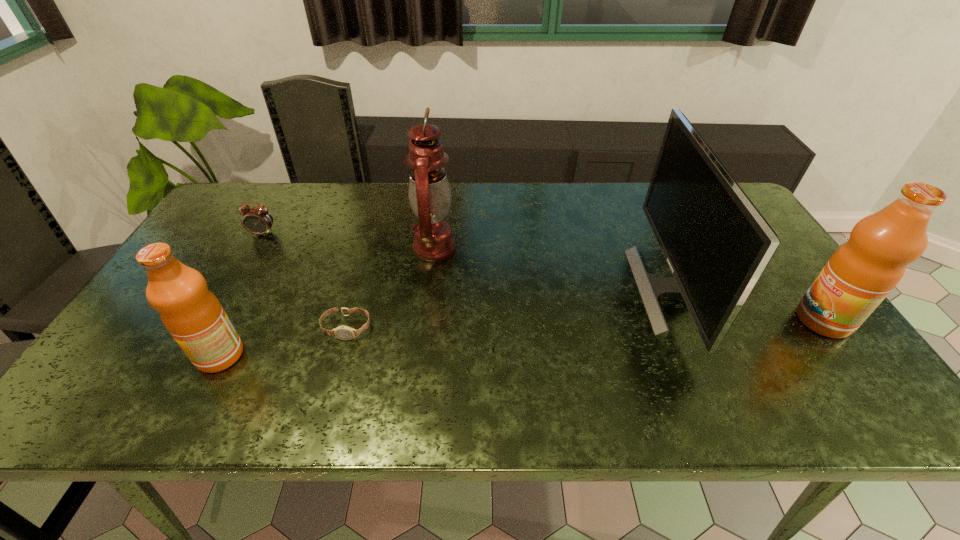
Where is `the fourth tallest object`? The height and width of the screenshot is (540, 960). the fourth tallest object is located at coordinates (192, 314).

Find the location of a particular element. The height and width of the screenshot is (540, 960). the shorter fruit juice is located at coordinates (192, 314).

Locate an element on the screen. The height and width of the screenshot is (540, 960). the right fruit juice is located at coordinates (860, 274).

The width and height of the screenshot is (960, 540). In order to click on the rightmost object in this screenshot , I will do `click(860, 274)`.

You are a GUI agent. You are given a task and a screenshot of the screen. Output one action in this format:
    pyautogui.click(x=<x>, y=<y>)
    Task: Click on the alarm clock
    
    Given the screenshot: What is the action you would take?
    pyautogui.click(x=257, y=220)

Where is `the third object from right to left`? This screenshot has width=960, height=540. the third object from right to left is located at coordinates (429, 192).

Where is `the third object from left to right`? This screenshot has height=540, width=960. the third object from left to right is located at coordinates (342, 332).

The image size is (960, 540). I want to click on the shortest object, so pos(342,332).

Locate an element on the screen. This screenshot has height=540, width=960. the fifth object from left to right is located at coordinates (717, 244).

You are a GUI agent. You are given a task and a screenshot of the screen. Output one action in this format:
    pyautogui.click(x=<x>, y=<y>)
    Task: Click on the vacant space situated on the label side of the fourth tallest object
    The image size is (960, 540).
    Given the screenshot: What is the action you would take?
    pyautogui.click(x=149, y=355)